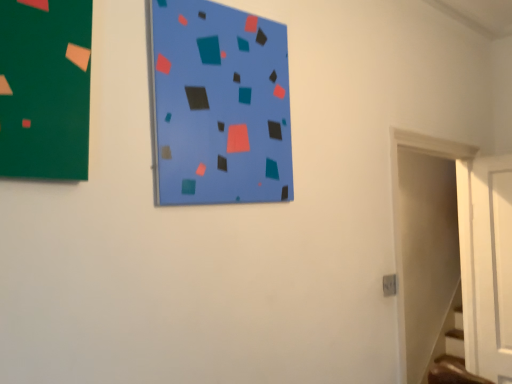
Question: Looking at the image, does white wooden door at right seem bigger or smaller compared to blue matte bulletin board at center?

Choices:
 (A) small
 (B) big

Answer: (B)

Question: Is white wooden door at right wider or thinner than blue matte bulletin board at center?

Choices:
 (A) thin
 (B) wide

Answer: (B)

Question: From the image's perspective, is white wooden door at right located above or below blue matte bulletin board at center?

Choices:
 (A) below
 (B) above

Answer: (A)

Question: Considering the positions of blue matte bulletin board at center and white wooden door at right in the image, is blue matte bulletin board at center wider or thinner than white wooden door at right?

Choices:
 (A) wide
 (B) thin

Answer: (B)

Question: From a real-world perspective, is blue matte bulletin board at center physically located above or below white wooden door at right?

Choices:
 (A) below
 (B) above

Answer: (B)

Question: Is point (254, 48) closer or farther from the camera than point (441, 246)?

Choices:
 (A) farther
 (B) closer

Answer: (B)

Question: From the image's perspective, is blue matte bulletin board at center located above or below white wooden door at right?

Choices:
 (A) below
 (B) above

Answer: (B)